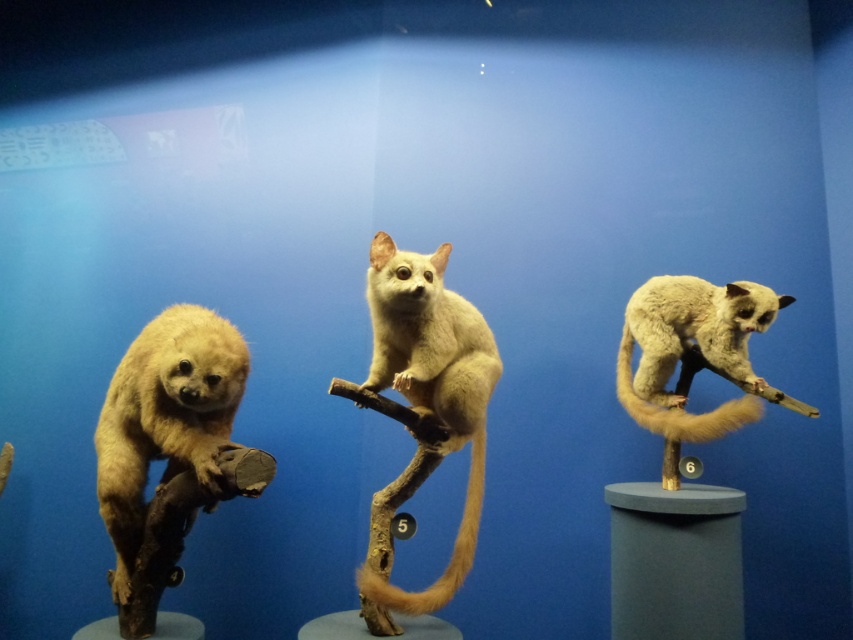
Is golden fur tail at center bigger than fuzzy white tail at right?

A: Yes.

Does golden fur tail at center appear over fuzzy white tail at right?

Actually, golden fur tail at center is below fuzzy white tail at right.

You are a GUI agent. You are given a task and a screenshot of the screen. Output one action in this format:
    pyautogui.click(x=<x>, y=<y>)
    Task: Click on the golden fur tail at center
    The image size is (853, 640).
    Given the screenshot: What is the action you would take?
    pyautogui.click(x=451, y=552)

This screenshot has height=640, width=853. I want to click on golden fur tail at center, so click(x=451, y=552).

Does fuzzy beige animal at center have a greater width compared to golden fur tail at center?

Yes, fuzzy beige animal at center is wider than golden fur tail at center.

Can you confirm if fuzzy beige animal at center is taller than golden fur tail at center?

Indeed, fuzzy beige animal at center has a greater height compared to golden fur tail at center.

The image size is (853, 640). Describe the element at coordinates (430, 387) in the screenshot. I see `fuzzy beige animal at center` at that location.

You are a GUI agent. You are given a task and a screenshot of the screen. Output one action in this format:
    pyautogui.click(x=<x>, y=<y>)
    Task: Click on the fuzzy beige animal at center
    
    Given the screenshot: What is the action you would take?
    pyautogui.click(x=430, y=387)

Who is more distant from viewer, (109, 522) or (752, 397)?

The point (752, 397) is behind.

Which of these two, light brown fur at left or fuzzy white tail at right, stands shorter?

With less height is fuzzy white tail at right.

Does point (210, 339) come closer to viewer compared to point (630, 337)?

Yes, point (210, 339) is in front of point (630, 337).

Image resolution: width=853 pixels, height=640 pixels. Identify the location of light brown fur at left. (165, 419).